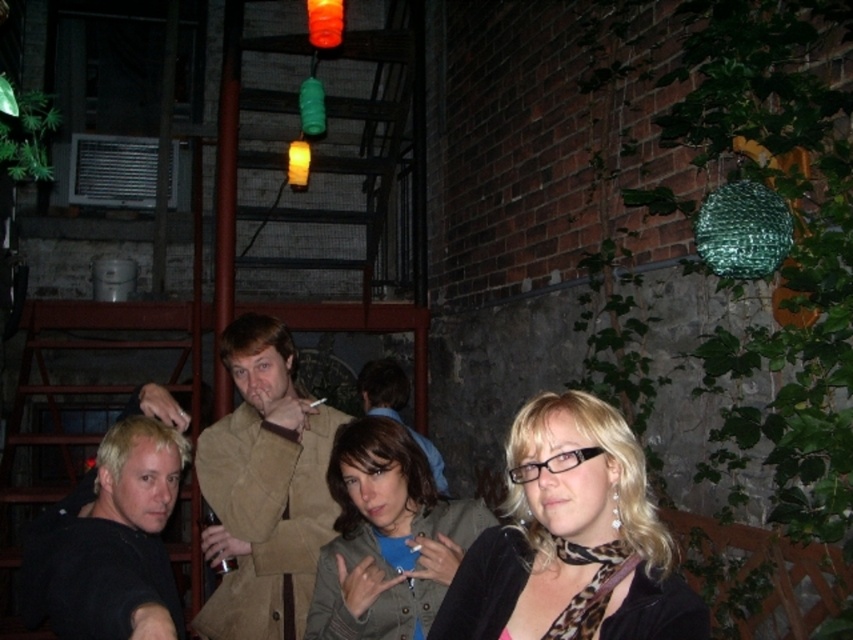
Question: Estimate the real-world distances between objects in this image. Which object is closer to the black matte shirt at lower left?

Choices:
 (A) tan suede coat at center
 (B) black matte jacket at center

Answer: (A)

Question: Which point is farther to the camera?

Choices:
 (A) green fabric jacket at center
 (B) tan suede coat at center
 (C) black matte shirt at lower left

Answer: (B)

Question: Is black matte shirt at lower left bigger than light brown leather jacket at center?

Choices:
 (A) no
 (B) yes

Answer: (A)

Question: Which of these objects is positioned closest to the tan suede coat at center?

Choices:
 (A) light brown leather jacket at center
 (B) black matte shirt at lower left
 (C) green fabric jacket at center

Answer: (C)

Question: Does green fabric jacket at center lie behind light brown leather jacket at center?

Choices:
 (A) yes
 (B) no

Answer: (B)

Question: Is the position of tan suede coat at center less distant than that of light brown leather jacket at center?

Choices:
 (A) yes
 (B) no

Answer: (A)